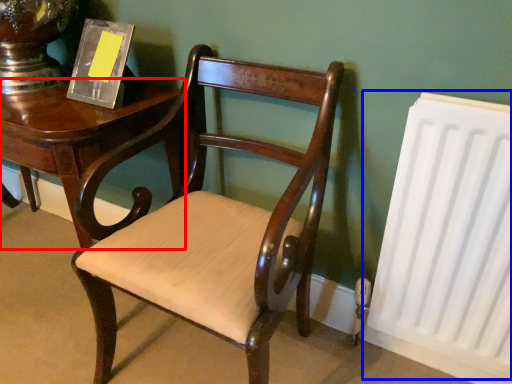
Question: Among these objects, which one is farthest to the camera, table (highlighted by a red box) or radiator (highlighted by a blue box)?

Choices:
 (A) table
 (B) radiator

Answer: (A)